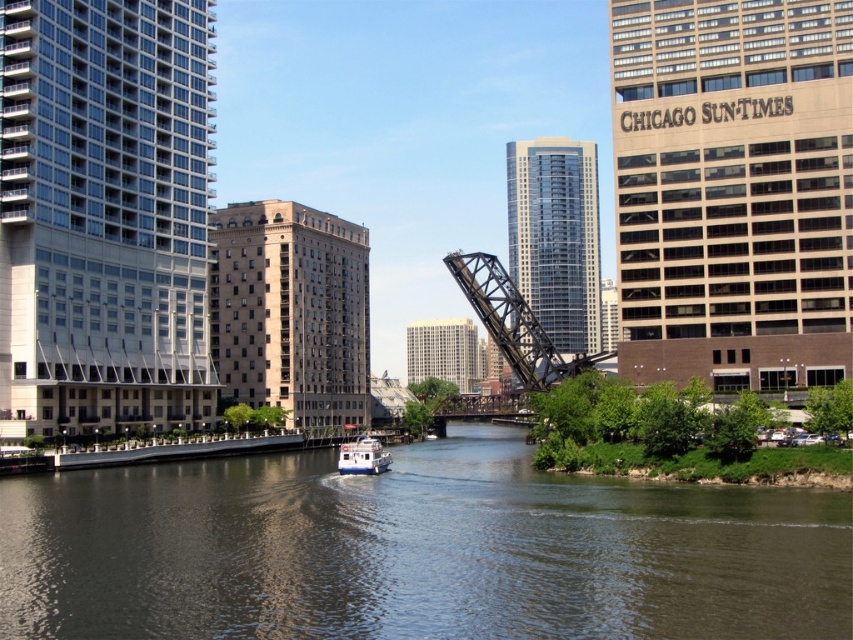
Consider the image. You are standing on the riverside and see the dark gray water at center and the white matte boat at center. Which object is positioned to the right from your perspective?

The dark gray water at center is to the right of the white matte boat at center, so the dark gray water at center is positioned to the right.

You are standing on the black steel bridge at center right and want to locate the point marked at coordinates point (415, 552). Based on the scene description, where would this point be relative to the dark gray water at center?

The point marked at coordinates point (415, 552) is located on the dark gray water at center, so it is directly on the water surface.

You are a photographer standing on the riverside. You want to capture a photo where the dark gray water at center is clearly visible in front of the white matte boat at center. Is this possible based on the scene?

Yes, because the dark gray water at center is positioned in front of the white matte boat at center, making it naturally visible in the foreground of the photo.